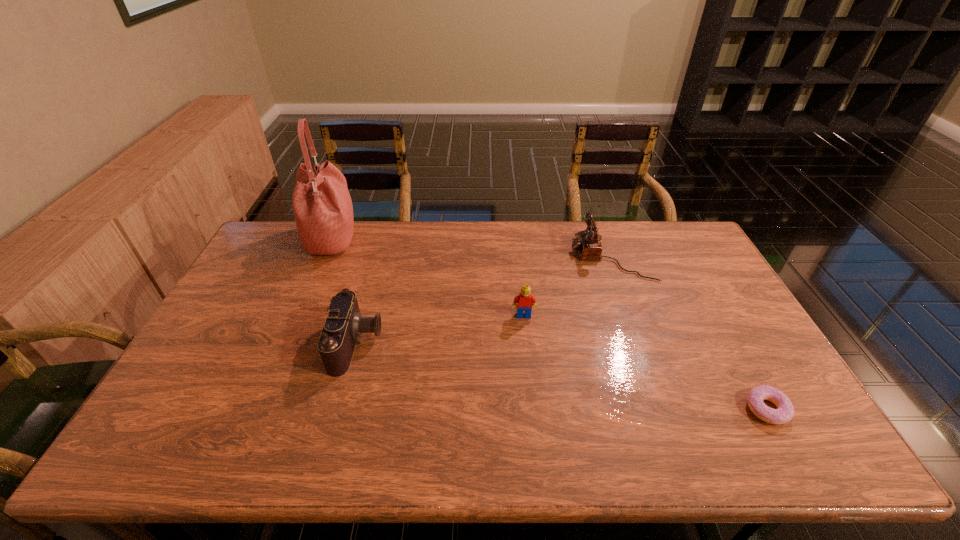
Image resolution: width=960 pixels, height=540 pixels. I want to click on free space between the fourth object from left to right and the doughnut, so click(x=688, y=333).

Where is `vacant region between the shortest object and the telephone`? The height and width of the screenshot is (540, 960). vacant region between the shortest object and the telephone is located at coordinates (688, 333).

Identify the location of free space that is in between the tallest object and the nearest object. (549, 325).

The width and height of the screenshot is (960, 540). Find the location of `empty space between the leftmost object and the telephone`. empty space between the leftmost object and the telephone is located at coordinates (470, 248).

This screenshot has width=960, height=540. I want to click on vacant space in between the telephone and the leftmost object, so click(x=470, y=248).

Locate an element on the screen. object that is the second closest one to the third object from right to left is located at coordinates click(x=344, y=324).

Identify the location of object that is the fourth nearest to the third object from right to left. (322, 206).

Locate an element on the screen. The width and height of the screenshot is (960, 540). vacant point that satisfies the following two spatial constraints: 1. on the front-facing side of the doughnut; 2. on the left side of the second object from left to right is located at coordinates (340, 409).

This screenshot has height=540, width=960. I want to click on free spot that satisfies the following two spatial constraints: 1. on the dial of the telephone; 2. on the face of the third object from left to right, so click(x=632, y=315).

This screenshot has height=540, width=960. Identify the location of free spot that satisfies the following two spatial constraints: 1. on the front-facing side of the shortest object; 2. on the left side of the camera. (340, 409).